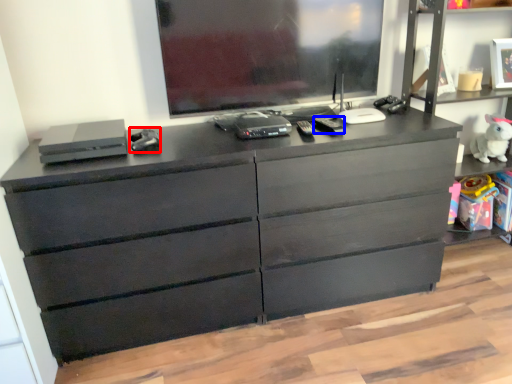
Question: Which object is closer to the camera taking this photo, equipment (highlighted by a red box) or equipment (highlighted by a blue box)?

Choices:
 (A) equipment
 (B) equipment

Answer: (A)